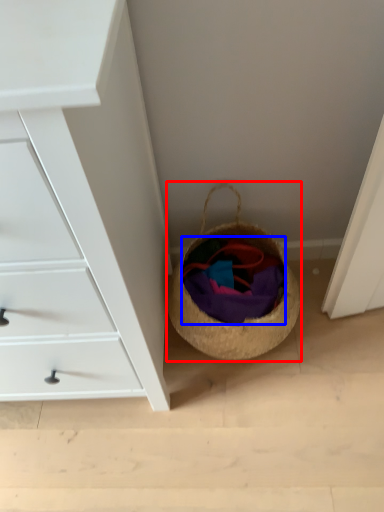
Question: Which object is closer to the camera taking this photo, basket (highlighted by a red box) or clothing (highlighted by a blue box)?

Choices:
 (A) basket
 (B) clothing

Answer: (A)